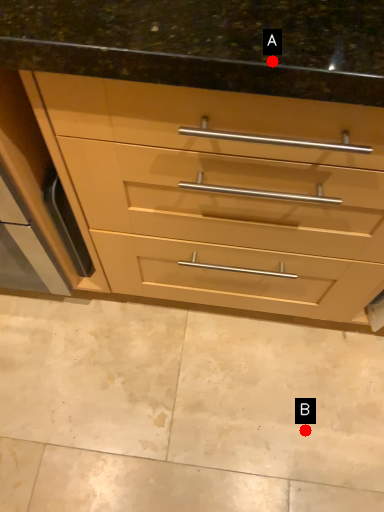
Question: Two points are circled on the image, labeled by A and B beside each circle. Which point is farther to the camera?

Choices:
 (A) A is further
 (B) B is further

Answer: (B)